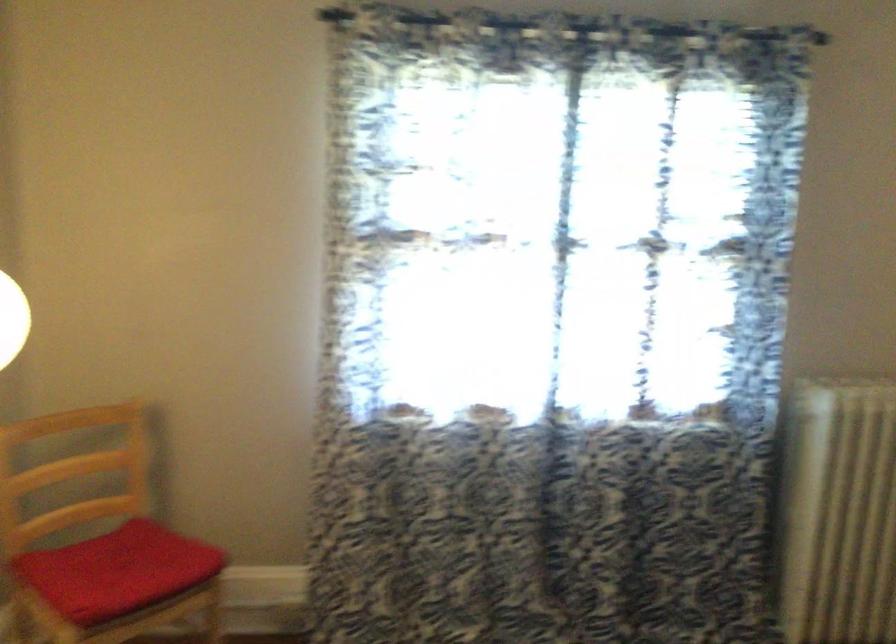
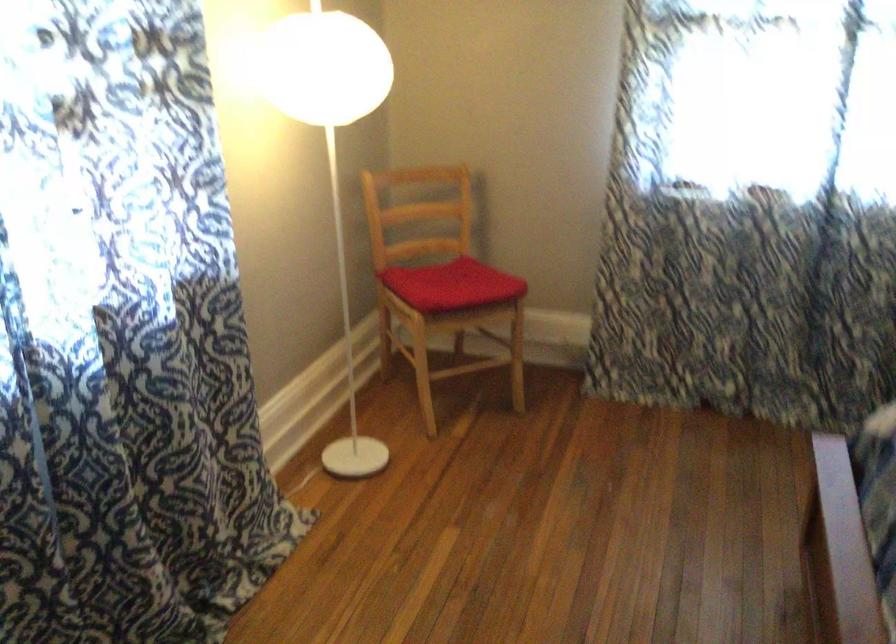
Question: The images are taken continuously from a first-person perspective. In which direction is your viewpoint rotating?

Choices:
 (A) Left
 (B) Right
 (C) Up
 (D) Down

Answer: (A)